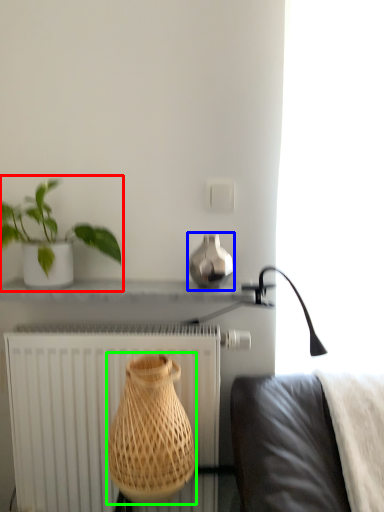
Question: Estimate the real-world distances between objects in this image. Which object is closer to houseplant (highlighted by a red box), vase (highlighted by a blue box) or vase (highlighted by a green box)?

Choices:
 (A) vase
 (B) vase

Answer: (A)